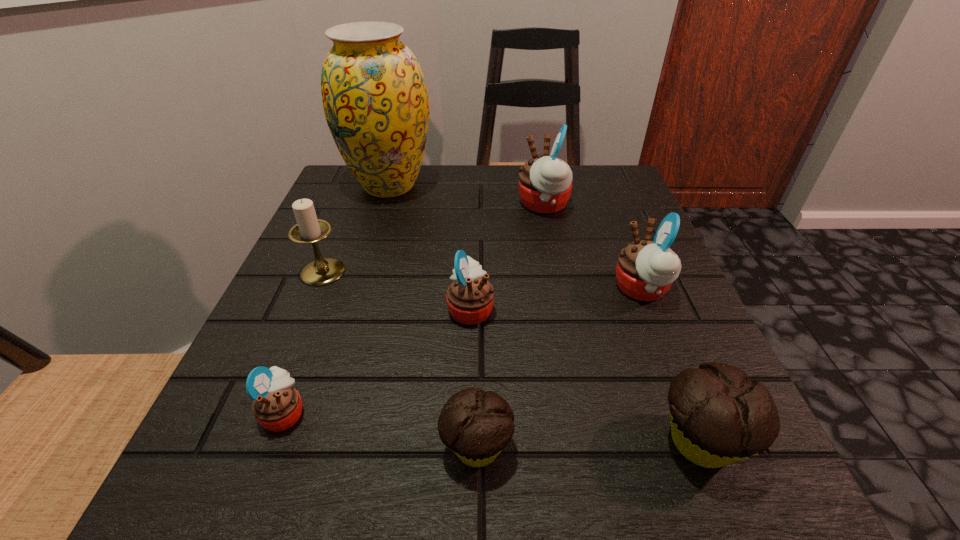
Locate an element on the screen. The height and width of the screenshot is (540, 960). the smallest pink muffin is located at coordinates (277, 406).

At what (x,y) coordinates should I click in order to perform the action: click on the smaller chocolate muffin. Please return your answer as a coordinate pair (x, y). The image size is (960, 540). Looking at the image, I should click on (476, 425).

At what (x,y) coordinates should I click in order to perform the action: click on vacant space located 0.360m on the right of the vase. Please return your answer as a coordinate pair (x, y). This screenshot has width=960, height=540. Looking at the image, I should click on (586, 185).

Locate an element on the screen. The height and width of the screenshot is (540, 960). vacant space located 0.090m on the front-facing side of the fourth muffin from left to right is located at coordinates (477, 205).

You are a GUI agent. You are given a task and a screenshot of the screen. Output one action in this format:
    pyautogui.click(x=<x>, y=<y>)
    Task: Click on the vacant position located 0.060m on the front-facing side of the fourth muffin from left to right
    The height and width of the screenshot is (540, 960).
    Given the screenshot: What is the action you would take?
    pyautogui.click(x=491, y=205)

This screenshot has width=960, height=540. I want to click on vacant area located 0.140m on the front-facing side of the fourth muffin from left to right, so click(455, 205).

Identify the location of free space located 0.290m on the right of the white candle holder. (501, 272).

At what (x,y) coordinates should I click in order to perform the action: click on free space located 0.210m on the front-facing side of the rightmost pink muffin. Please return your answer as a coordinate pair (x, y). This screenshot has width=960, height=540. Looking at the image, I should click on (494, 289).

The image size is (960, 540). Identify the location of free region located on the front-facing side of the rightmost pink muffin. (546, 289).

Find the location of a particular element. free point located on the front-facing side of the rightmost pink muffin is located at coordinates (568, 289).